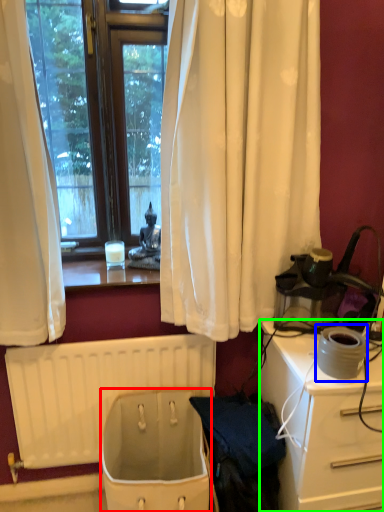
Question: Which object is positioned farthest from toilet bowl (highlighted by a red box)? Select from appliance (highlighted by a blue box) and desk (highlighted by a green box).

Choices:
 (A) appliance
 (B) desk

Answer: (A)